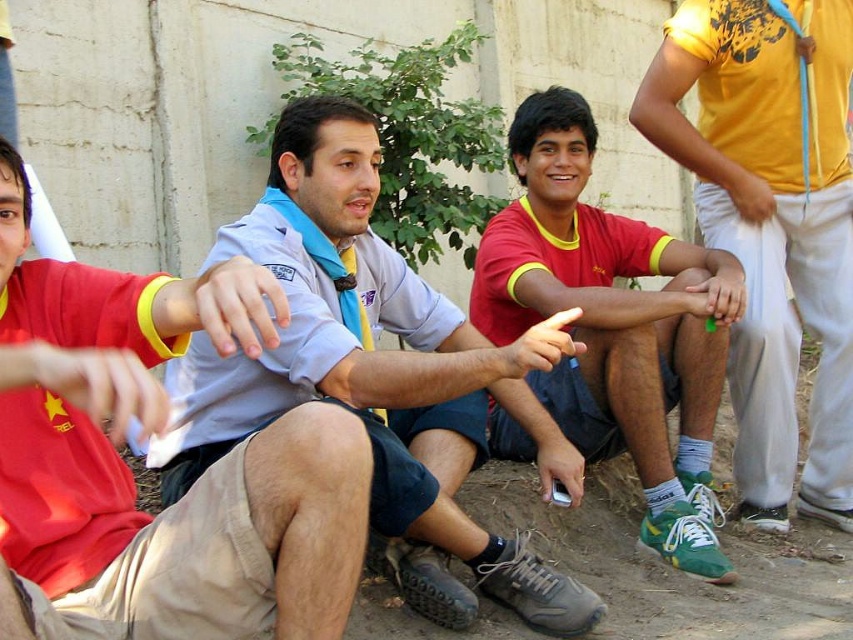
You are organizing a group photo and need to arrange the light blue shirt at center and the yellow cotton shirt at upper right in a row. If you want the smaller person to stand in front, which shirt should be placed in front?

The light blue shirt at center is smaller than the yellow cotton shirt at upper right, so the light blue shirt at center should be placed in front.